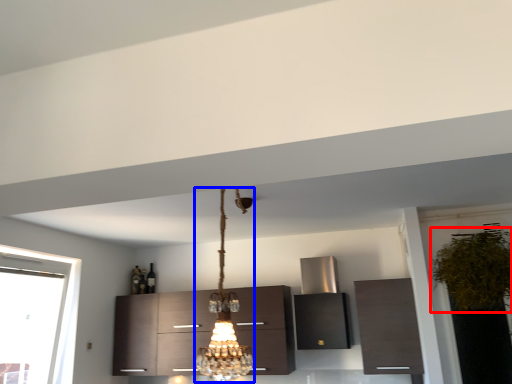
Question: Which of the following is the closest to the observer, plant (highlighted by a red box) or lamp (highlighted by a blue box)?

Choices:
 (A) plant
 (B) lamp

Answer: (B)